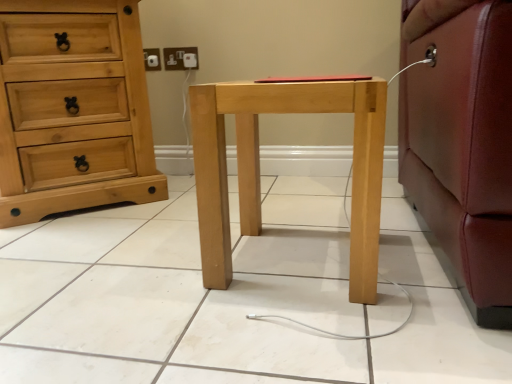
At what (x,y) coordinates should I click in order to perform the action: click on free space in front of natural wood chest of drawers at left. Please return your answer as a coordinate pair (x, y). Looking at the image, I should click on pos(87,246).